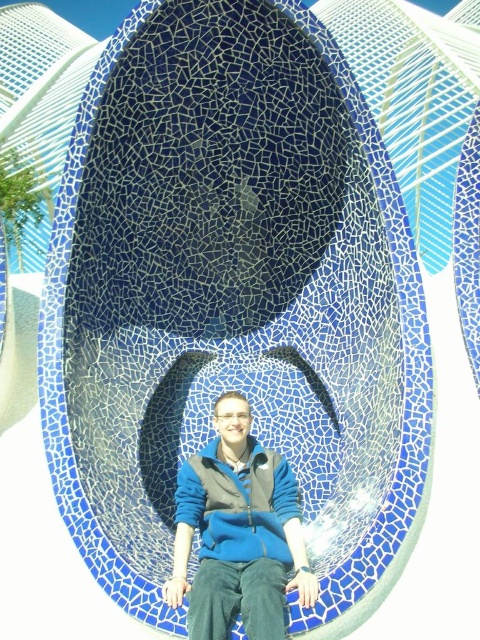
Question: Which of the following is the closest to the observer?

Choices:
 (A) (216, 410)
 (B) (284, 465)

Answer: (B)

Question: Where is blue matte sweater at center located in relation to blue fleece sweatshirt at center in the image?

Choices:
 (A) right
 (B) left

Answer: (A)

Question: Can you confirm if blue matte sweater at center is positioned below blue fleece sweatshirt at center?

Choices:
 (A) yes
 (B) no

Answer: (A)

Question: Which point is closer to the camera?

Choices:
 (A) (229, 490)
 (B) (289, 540)

Answer: (B)

Question: Which point appears closest to the camera in this image?

Choices:
 (A) (241, 570)
 (B) (227, 468)

Answer: (A)

Question: Does blue matte sweater at center appear on the left side of blue fleece sweatshirt at center?

Choices:
 (A) yes
 (B) no

Answer: (B)